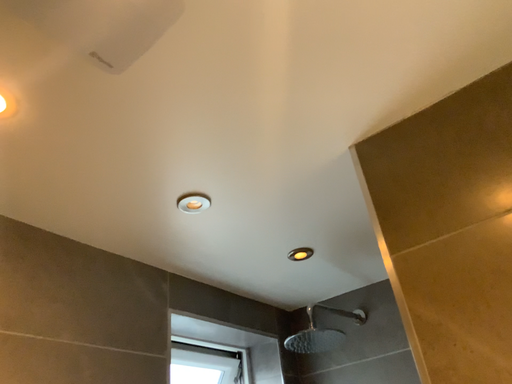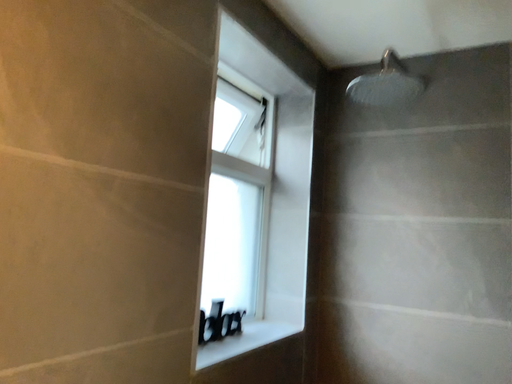
Question: How did the camera likely rotate when shooting the video?

Choices:
 (A) rotated downward
 (B) rotated upward

Answer: (A)